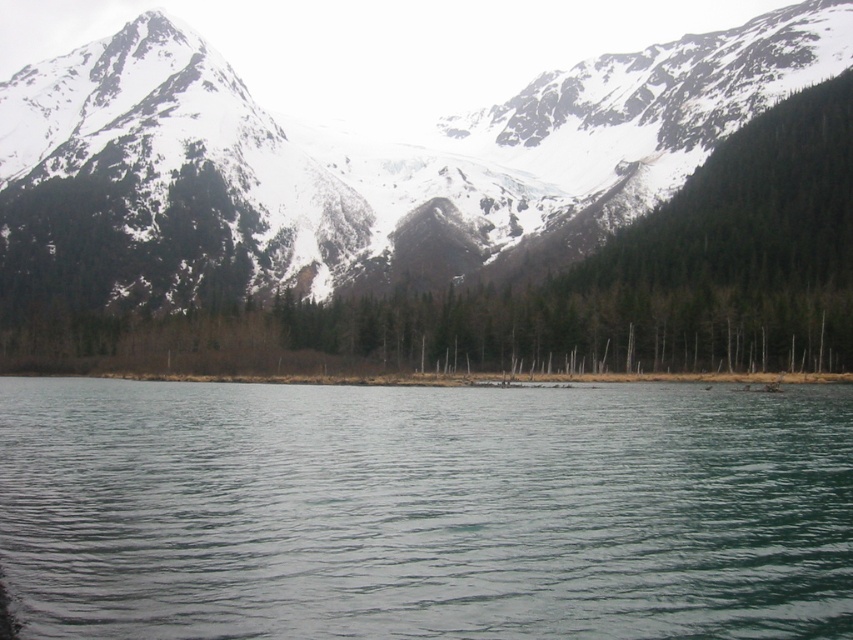
Question: Which of the following is the closest to the observer?

Choices:
 (A) clear water at center
 (B) snowy granite mountain range at upper center

Answer: (A)

Question: Which of the following is the farthest from the observer?

Choices:
 (A) snowy granite mountain range at upper center
 (B) clear water at center

Answer: (A)

Question: From the image, what is the correct spatial relationship of clear water at center in relation to snowy granite mountain range at upper center?

Choices:
 (A) below
 (B) above

Answer: (A)

Question: Is the position of clear water at center more distant than that of snowy granite mountain range at upper center?

Choices:
 (A) yes
 (B) no

Answer: (B)

Question: Where is clear water at center located in relation to snowy granite mountain range at upper center in the image?

Choices:
 (A) above
 (B) below

Answer: (B)